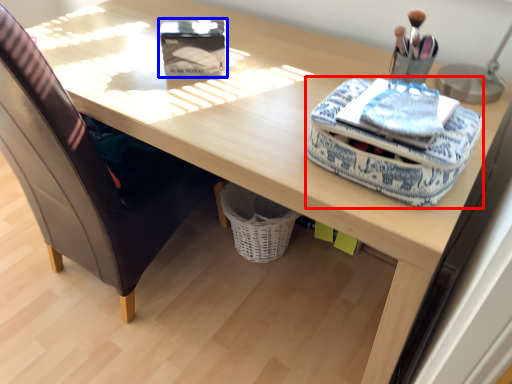
Question: Which object appears farthest to the camera in this image, material (highlighted by a red box) or storage box (highlighted by a blue box)?

Choices:
 (A) material
 (B) storage box

Answer: (B)